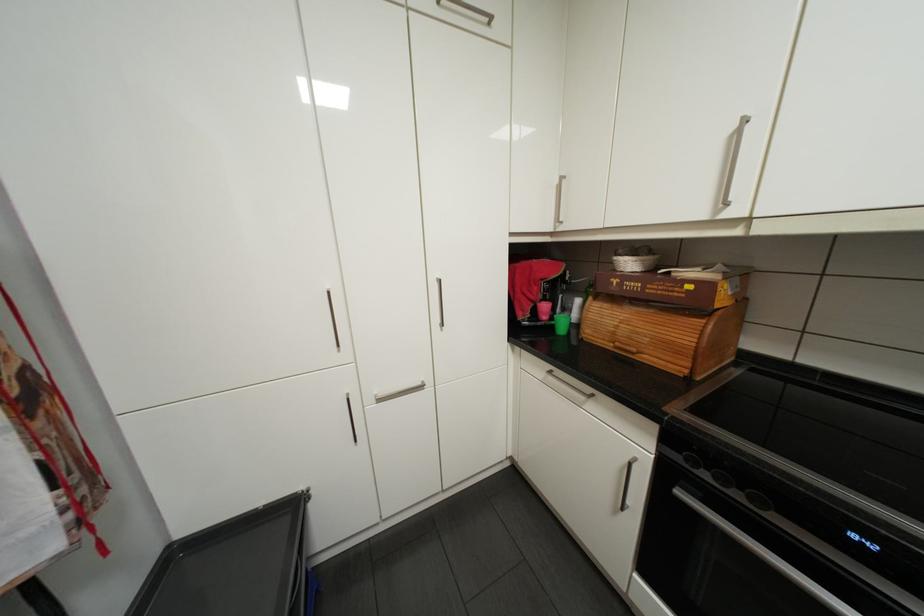
The height and width of the screenshot is (616, 924). What are the coordinates of `white plastic shaker` in the screenshot? It's located at (572, 304).